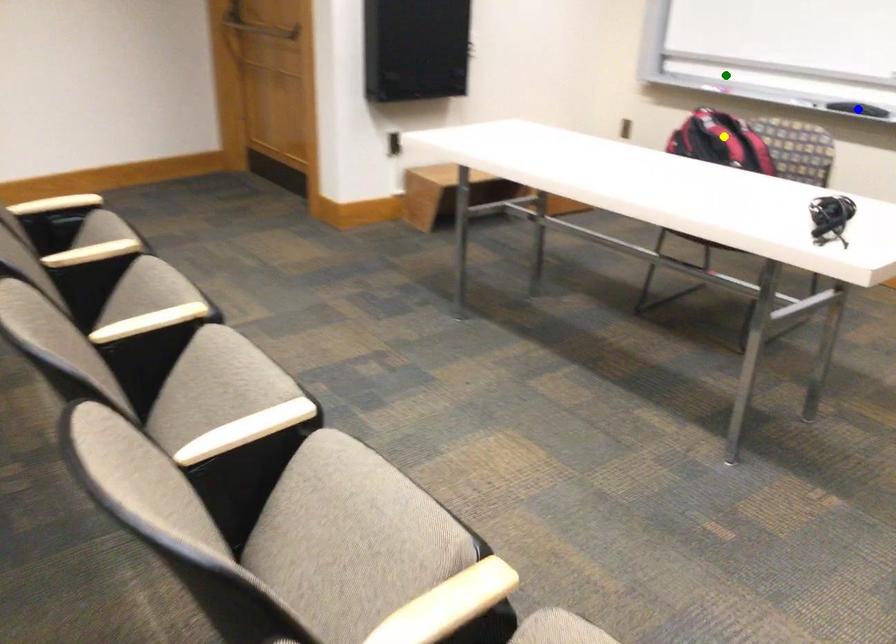
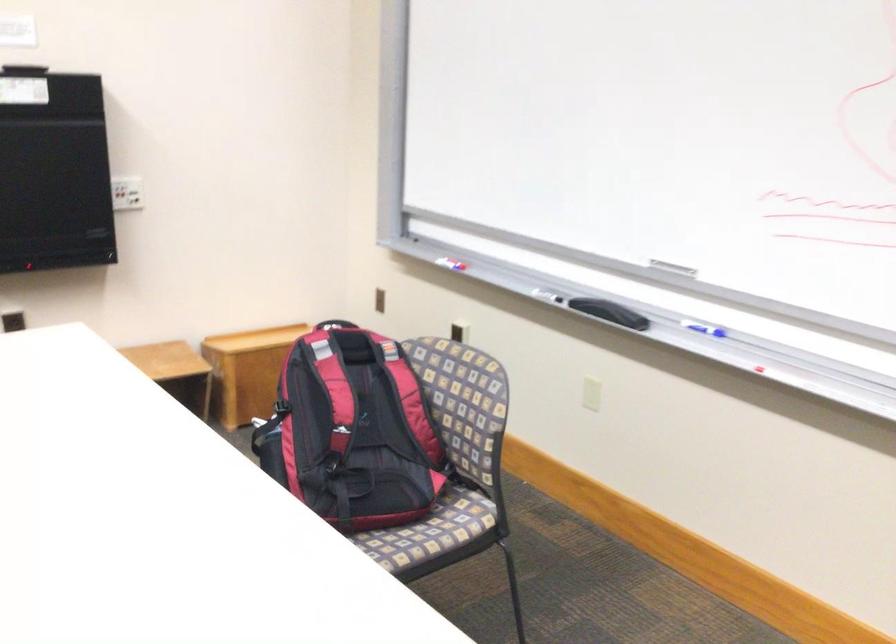
I am providing you with two images of the same scene from different viewpoints. Three points are marked in image1. Which point corresponds to a part or object that is occluded in image2?In image1, three points are marked. Which of them correspond to a part or object that is occluded in image2?Among the three points shown in image1, which one corresponds to a part or object that is no longer visible due to occlusion in image2?

blue point